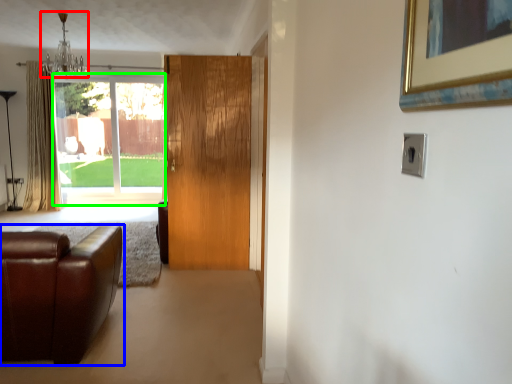
Question: Estimate the real-world distances between objects in this image. Which object is closer to light fixture (highlighted by a red box), studio couch (highlighted by a blue box) or window (highlighted by a green box)?

Choices:
 (A) studio couch
 (B) window

Answer: (B)